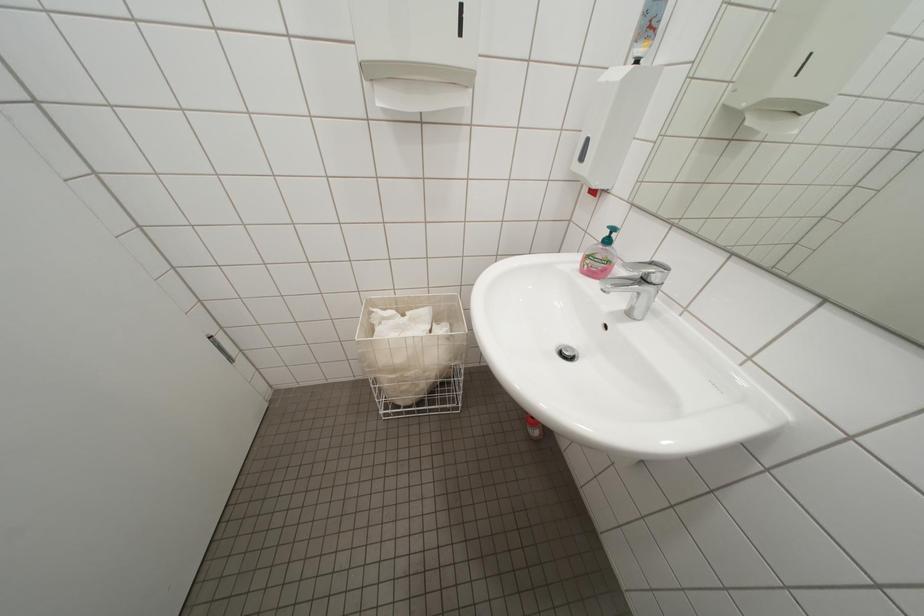
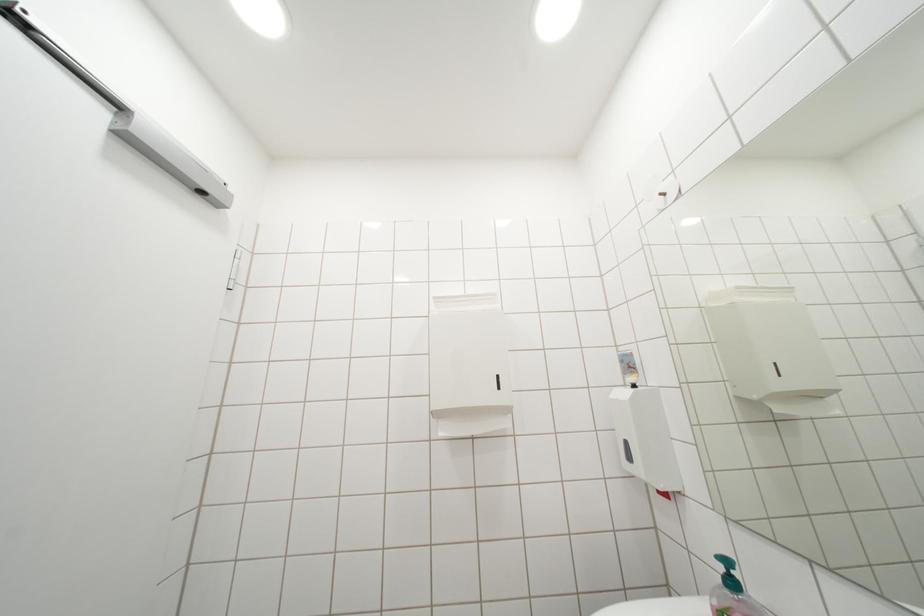
Question: The first image is from the beginning of the video and the second image is from the end. How did the camera likely rotate when shooting the video?

Choices:
 (A) Left
 (B) Right
 (C) Up
 (D) Down

Answer: (C)